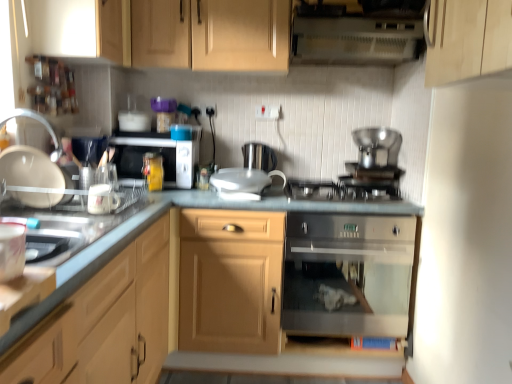
Question: Considering the relative sizes of white plastic vent at upper center and stainless steel oven at center in the image provided, is white plastic vent at upper center thinner than stainless steel oven at center?

Choices:
 (A) no
 (B) yes

Answer: (B)

Question: Is white plastic vent at upper center oriented towards stainless steel oven at center?

Choices:
 (A) no
 (B) yes

Answer: (A)

Question: Is white plastic vent at upper center smaller than stainless steel oven at center?

Choices:
 (A) no
 (B) yes

Answer: (B)

Question: Is white plastic vent at upper center closer to the viewer compared to stainless steel oven at center?

Choices:
 (A) yes
 (B) no

Answer: (A)

Question: Is white plastic vent at upper center touching stainless steel oven at center?

Choices:
 (A) no
 (B) yes

Answer: (A)

Question: From the image's perspective, is white plastic vent at upper center over stainless steel oven at center?

Choices:
 (A) no
 (B) yes

Answer: (B)

Question: Does light wood cabinet at upper left, which is the second cabinetry in top-to-bottom order, have a greater height compared to wooden cabinet at upper center, which is counted as the first cabinetry, starting from the top?

Choices:
 (A) no
 (B) yes

Answer: (A)

Question: Can you confirm if light wood cabinet at upper left, the third cabinetry ordered from the bottom, is positioned to the left of wooden cabinet at upper center, which is counted as the first cabinetry, starting from the top?

Choices:
 (A) yes
 (B) no

Answer: (A)

Question: Is wooden cabinet at upper center, marked as the fourth cabinetry in a bottom-to-top arrangement, located within light wood cabinet at upper left, which is the second cabinetry in top-to-bottom order?

Choices:
 (A) yes
 (B) no

Answer: (B)

Question: Is light wood cabinet at upper left, the third cabinetry ordered from the bottom, at the right side of wooden cabinet at upper center, which is counted as the first cabinetry, starting from the top?

Choices:
 (A) yes
 (B) no

Answer: (B)

Question: Is light wood cabinet at upper left, which is the second cabinetry in top-to-bottom order, far away from wooden cabinet at upper center, marked as the fourth cabinetry in a bottom-to-top arrangement?

Choices:
 (A) no
 (B) yes

Answer: (A)

Question: Can you confirm if light wood cabinet at upper left, the third cabinetry ordered from the bottom, is shorter than wooden cabinet at upper center, which is counted as the first cabinetry, starting from the top?

Choices:
 (A) no
 (B) yes

Answer: (B)

Question: From a real-world perspective, does wooden cabinet at upper center, which is counted as the first cabinetry, starting from the top, stand above light wood cabinet at upper left, the third cabinetry ordered from the bottom?

Choices:
 (A) yes
 (B) no

Answer: (A)